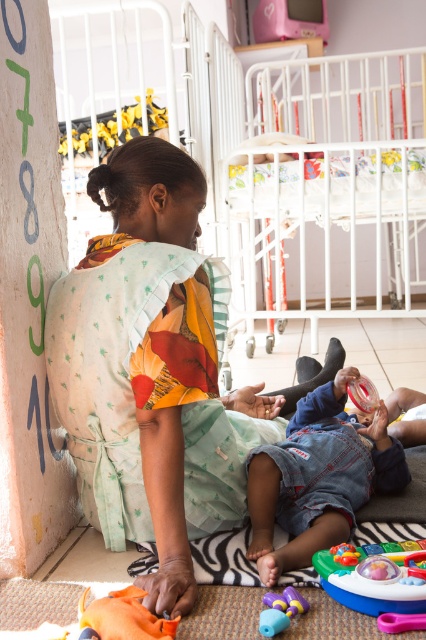
You are a parent visiting the nursery and want to know what clothing item is located at the coordinates point (x=319, y=477) in the lower center area. What is it?

The point (x=319, y=477) at lower center indicates denim jeans, so the clothing item at that location is denim jeans.

You are a parent trying to place a small toy on the floor between the denim jeans at lower center and the translucent purple toy at lower center. Can you estimate if there is enough space to place the toy without it overlapping either object?

The denim jeans at lower center might be wider than the translucent purple toy at lower center, so there may not be enough space between them to place the toy without overlapping. Check the actual distance before placing it.